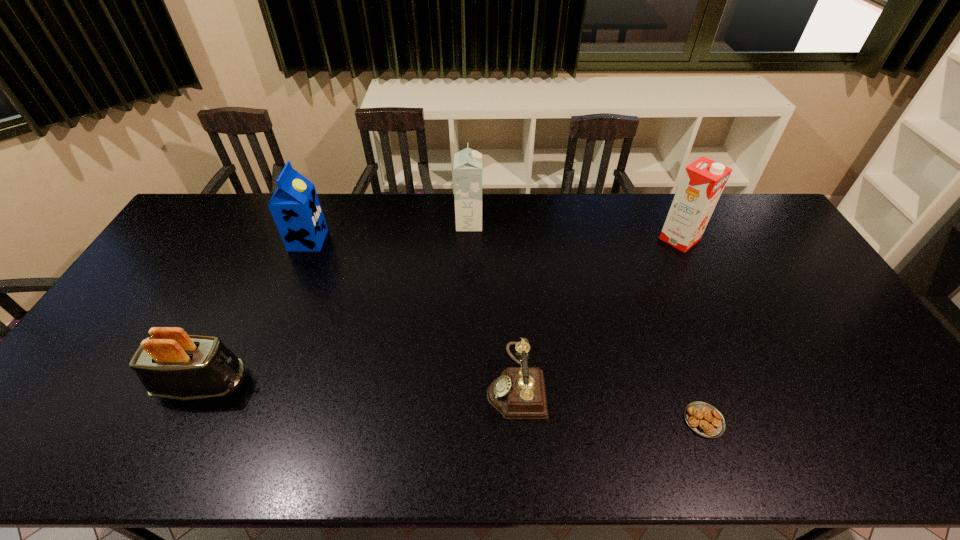
Where is `free point between the leftmost carton and the rightmost carton`? The width and height of the screenshot is (960, 540). free point between the leftmost carton and the rightmost carton is located at coordinates click(493, 240).

Where is `vacant area that lies between the second shortest object and the shortest object`? The width and height of the screenshot is (960, 540). vacant area that lies between the second shortest object and the shortest object is located at coordinates (610, 401).

What are the coordinates of `object that is the third closest one to the toaster` in the screenshot? It's located at (467, 168).

Where is `the fourth closest object to the toaster`? the fourth closest object to the toaster is located at coordinates (704, 419).

Locate which carton is the closest to the second carton from left to right. Please provide its 2D coordinates. Your answer should be formatted as a tuple, i.e. [(x, y)], where the tuple contains the x and y coordinates of a point satisfying the conditions above.

[(295, 207)]

Identify which carton is the second closest to the fourth object from right to left. Please provide its 2D coordinates. Your answer should be formatted as a tuple, i.e. [(x, y)], where the tuple contains the x and y coordinates of a point satisfying the conditions above.

[(702, 182)]

Image resolution: width=960 pixels, height=540 pixels. What are the coordinates of `free space that satisfies the following two spatial constraints: 1. on the side of the toaster with the control lever; 2. on the left side of the second object from right to left` in the screenshot? It's located at (185, 421).

Where is `vacant area that satisfies the following two spatial constraints: 1. on the dial of the second object from right to left; 2. on the left side of the second shortest object`? Image resolution: width=960 pixels, height=540 pixels. vacant area that satisfies the following two spatial constraints: 1. on the dial of the second object from right to left; 2. on the left side of the second shortest object is located at coordinates (517, 421).

The width and height of the screenshot is (960, 540). I want to click on vacant area that satisfies the following two spatial constraints: 1. on the front label of the second carton from left to right; 2. on the left side of the shortest object, so click(464, 421).

What are the coordinates of `free point that satisfies the following two spatial constraints: 1. on the side of the fourth tallest object with the control lever; 2. on the left side of the shortest object` in the screenshot? It's located at (185, 421).